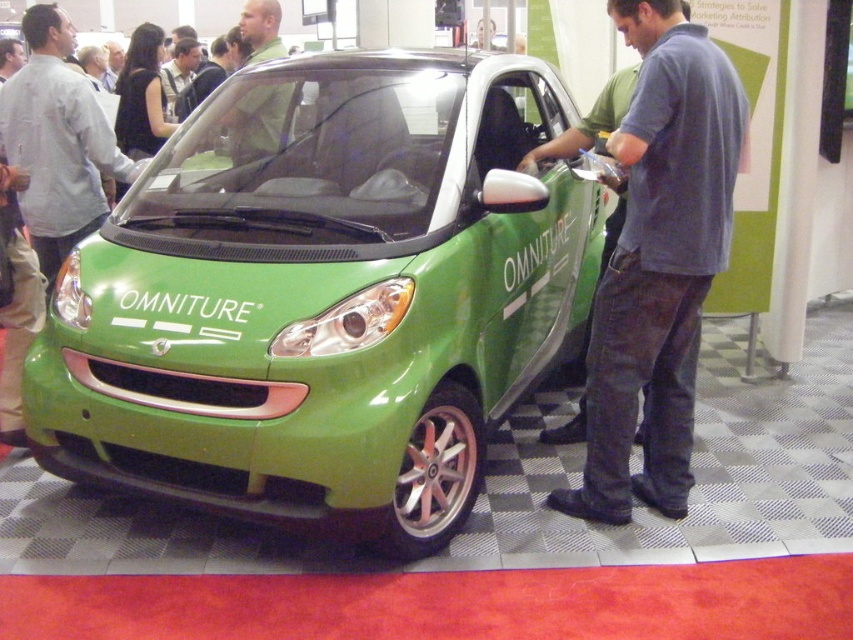
You are organizing a photoshoot and need to decide which shirt to use as the main prop. Both the matte gray shirt at center and the green matte shirt at center are available. Based on their sizes, which shirt would you choose if you want a larger one for better visibility?

The matte gray shirt at center has a larger width than the green matte shirt at center, so you should choose the matte gray shirt at center for better visibility.

You are a fashion designer who needs to place a 4.5 feet wide mannequin between the matte gray shirt at center and the green matte shirt at center. Can the mannequin fit between them without overlapping?

The distance between the matte gray shirt at center and the green matte shirt at center is 4.49 feet. Since the mannequin is 4.5 feet wide, it cannot fit between them without overlapping as the space is slightly smaller than the mannequin.

You are a fashion designer observing a model wearing denim jeans at center and green matte shirt at center. Which clothing item is longer in length?

The denim jeans at center is taller than the green matte shirt at center, so the denim jeans at center is longer in length.